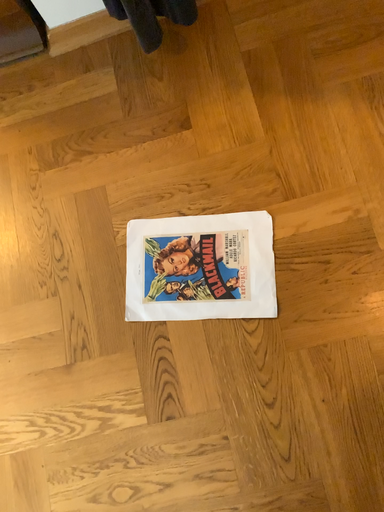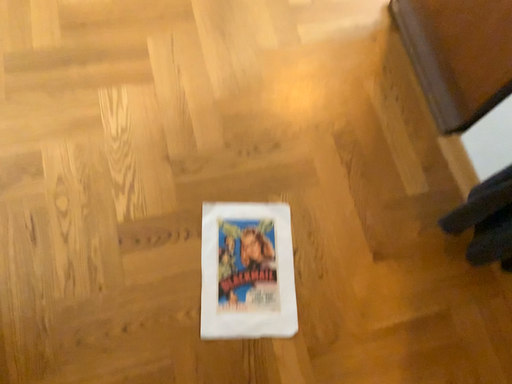
Question: Which way did the camera rotate in the video?

Choices:
 (A) rotated upward
 (B) rotated downward

Answer: (A)